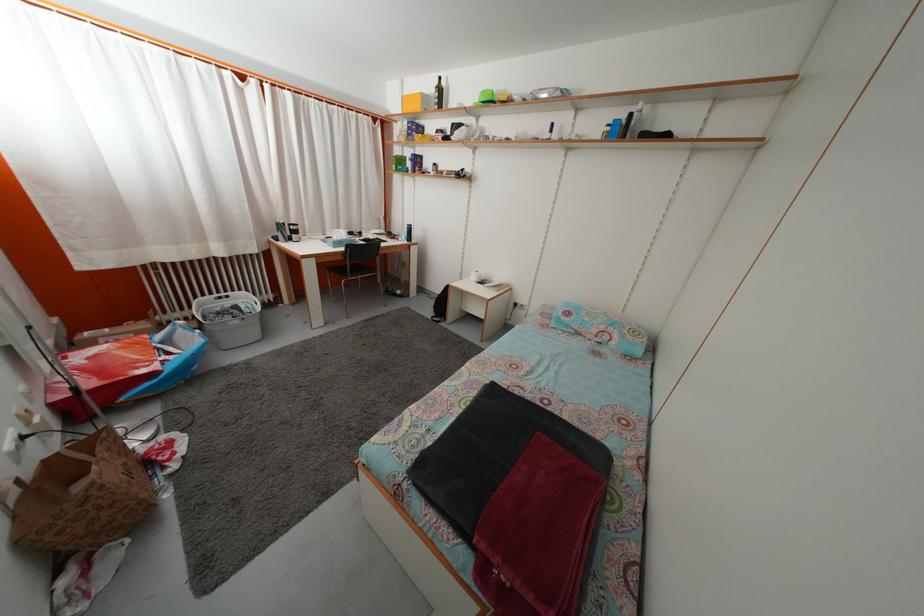
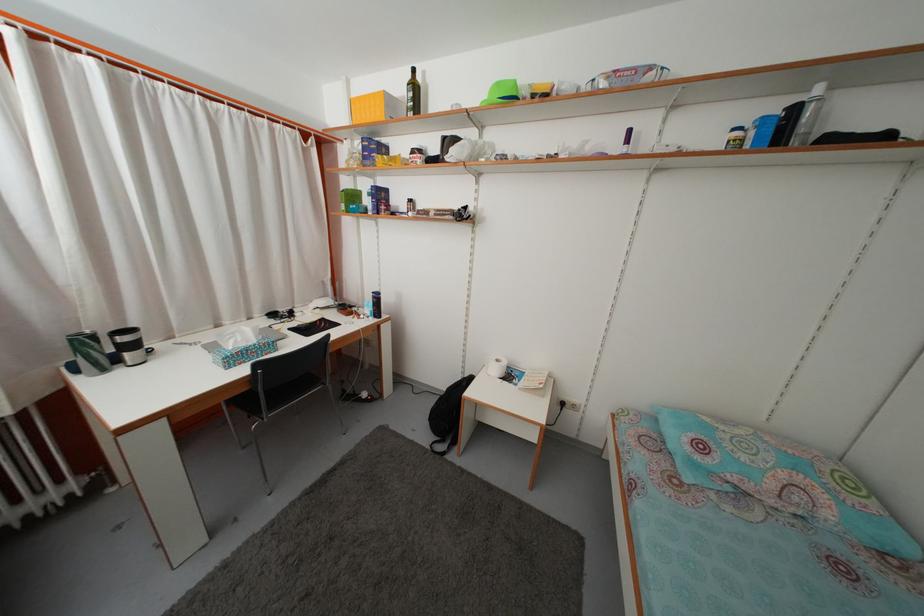
Question: What movement of the cameraman would produce the second image?

Choices:
 (A) Left
 (B) Right
 (C) Forward
 (D) Backward

Answer: (C)